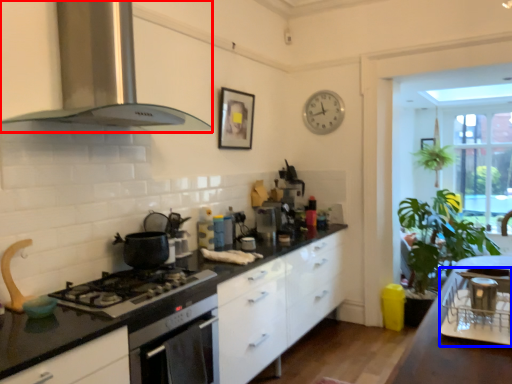
Question: Among these objects, which one is farthest to the camera, kitchen appliance (highlighted by a red box) or appliance (highlighted by a blue box)?

Choices:
 (A) kitchen appliance
 (B) appliance

Answer: (A)